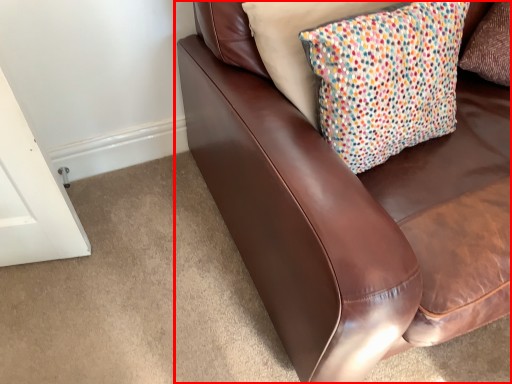
Question: Observing the image, what is the correct spatial positioning of studio couch (annotated by the red box) in reference to pillow?

Choices:
 (A) right
 (B) left

Answer: (A)